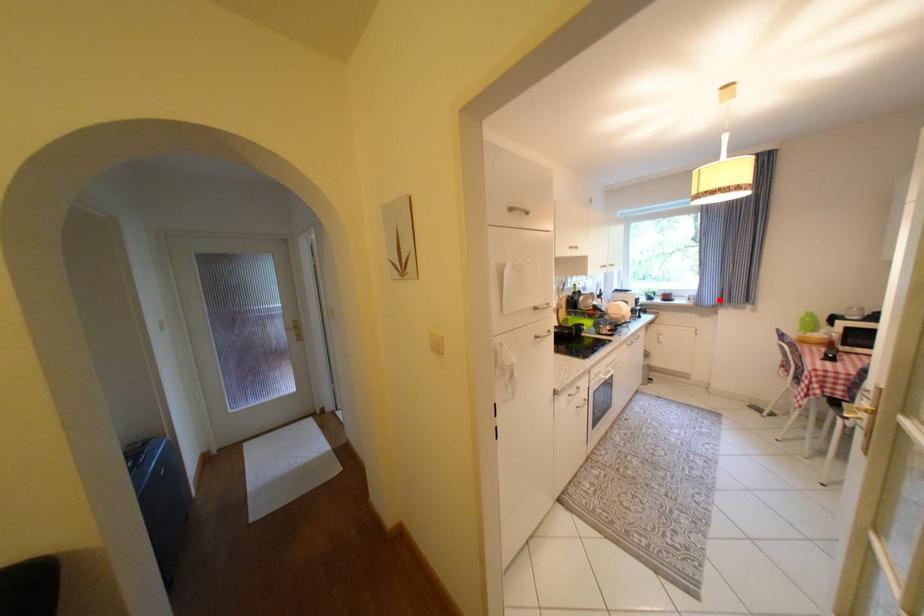
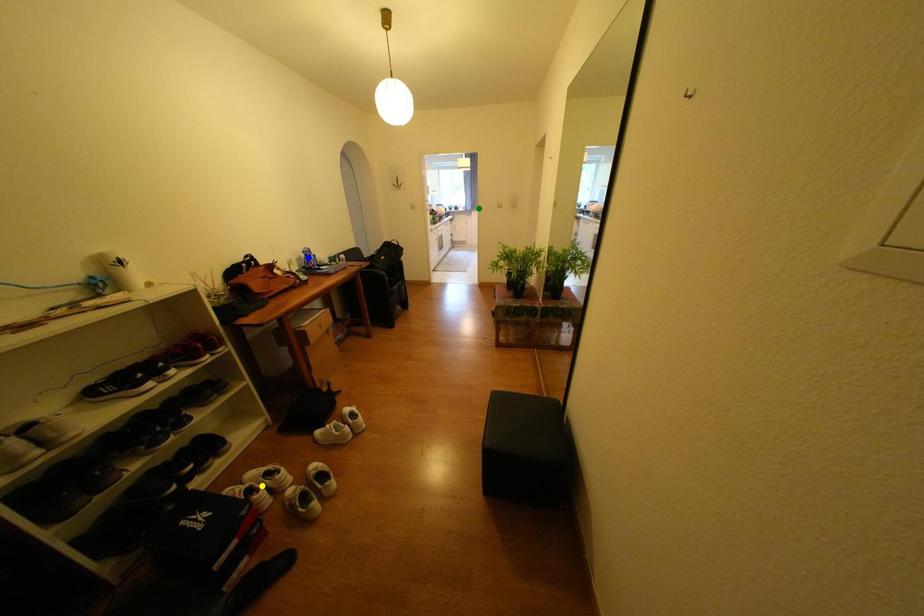
Question: I am providing you with two images of the same scene from different viewpoints. A red point is marked on the first image. You are given multiple points on the second image. In image 2, which mark is for the same physical point as the one in image 1?

Choices:
 (A) blue point
 (B) yellow point
 (C) green point

Answer: (C)